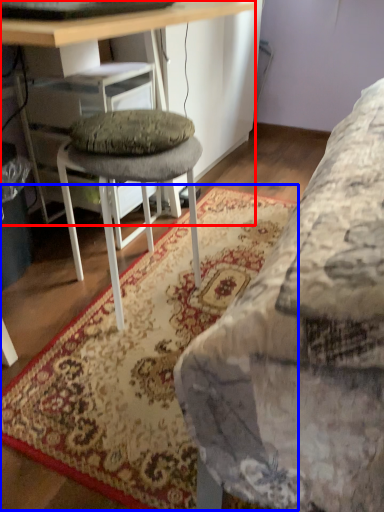
Question: Which object is further to the camera taking this photo, desk (highlighted by a red box) or mat (highlighted by a blue box)?

Choices:
 (A) desk
 (B) mat

Answer: (B)